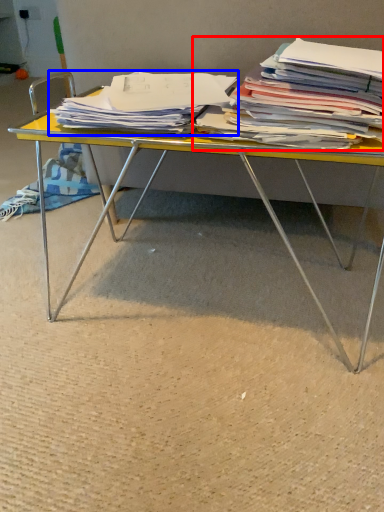
Question: Which object is further to the camera taking this photo, magazine (highlighted by a red box) or magazine (highlighted by a blue box)?

Choices:
 (A) magazine
 (B) magazine

Answer: (B)